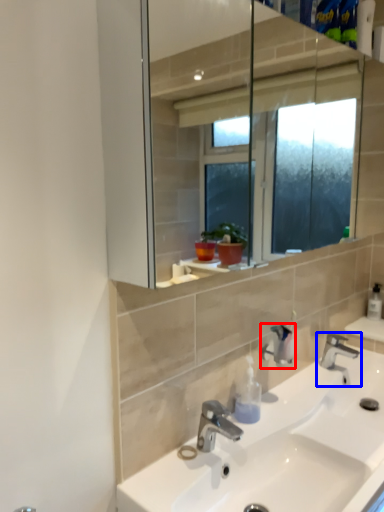
Question: Which point is closer to the camera, plumbing fixture (highlighted by a red box) or tap (highlighted by a blue box)?

Choices:
 (A) plumbing fixture
 (B) tap

Answer: (A)